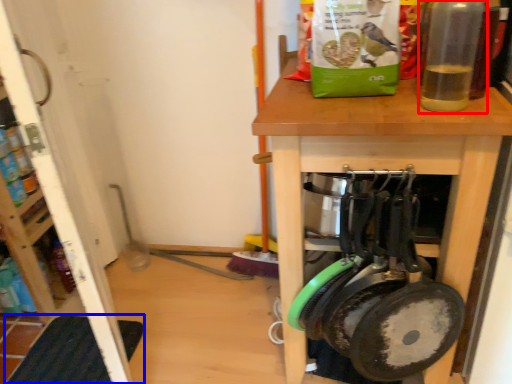
Question: Which point is further to the camera, bottle (highlighted by a red box) or mat (highlighted by a blue box)?

Choices:
 (A) bottle
 (B) mat

Answer: (B)